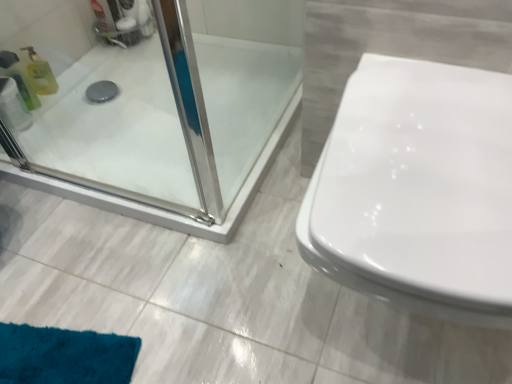
Locate an element on the screen. The height and width of the screenshot is (384, 512). vacant area located to the right-hand side of translucent plastic bottle at left, which ranks as the first cleaning product in back-to-front order is located at coordinates pos(88,99).